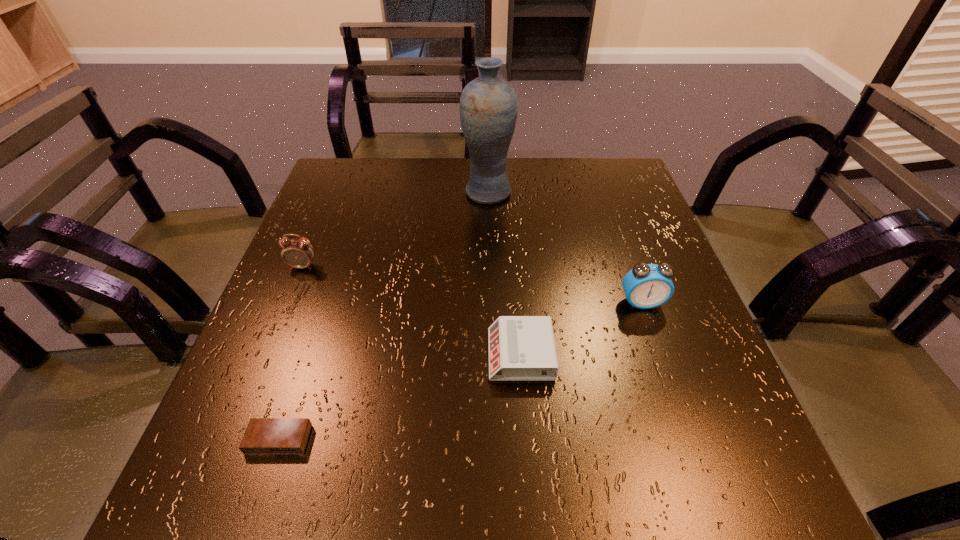
At what (x,y) coordinates should I click in order to perform the action: click on free space between the shortest object and the farthest alarm clock. Please return your answer as a coordinate pair (x, y). Image resolution: width=960 pixels, height=540 pixels. Looking at the image, I should click on (291, 353).

Identify the location of free spot between the third nearest object and the nearest alarm clock. (461, 371).

In order to click on vacant space in between the shortest object and the third alarm clock from left to right in this screenshot , I will do tap(399, 397).

You are a GUI agent. You are given a task and a screenshot of the screen. Output one action in this format:
    pyautogui.click(x=<x>, y=<y>)
    Task: Click on the unoccupied area between the second shortest object and the nearest alarm clock
    
    Given the screenshot: What is the action you would take?
    pyautogui.click(x=399, y=397)

I want to click on vacant area that lies between the second shortest object and the vase, so click(504, 273).

Identify which object is the third closest to the farthest alarm clock. Please provide its 2D coordinates. Your answer should be formatted as a tuple, i.e. [(x, y)], where the tuple contains the x and y coordinates of a point satisfying the conditions above.

[(521, 348)]

Choose which object is the third nearest neighbor to the third nearest object. Please provide its 2D coordinates. Your answer should be formatted as a tuple, i.e. [(x, y)], where the tuple contains the x and y coordinates of a point satisfying the conditions above.

[(263, 435)]

Identify which alarm clock is the third nearest to the farthest object. Please provide its 2D coordinates. Your answer should be formatted as a tuple, i.e. [(x, y)], where the tuple contains the x and y coordinates of a point satisfying the conditions above.

[(521, 348)]

Where is `the third closest alarm clock to the vase`? Image resolution: width=960 pixels, height=540 pixels. the third closest alarm clock to the vase is located at coordinates (521, 348).

The width and height of the screenshot is (960, 540). Identify the location of vacant space that satisfies the following two spatial constraints: 1. on the face of the farthest alarm clock; 2. on the right side of the second shortest alarm clock. [267, 354].